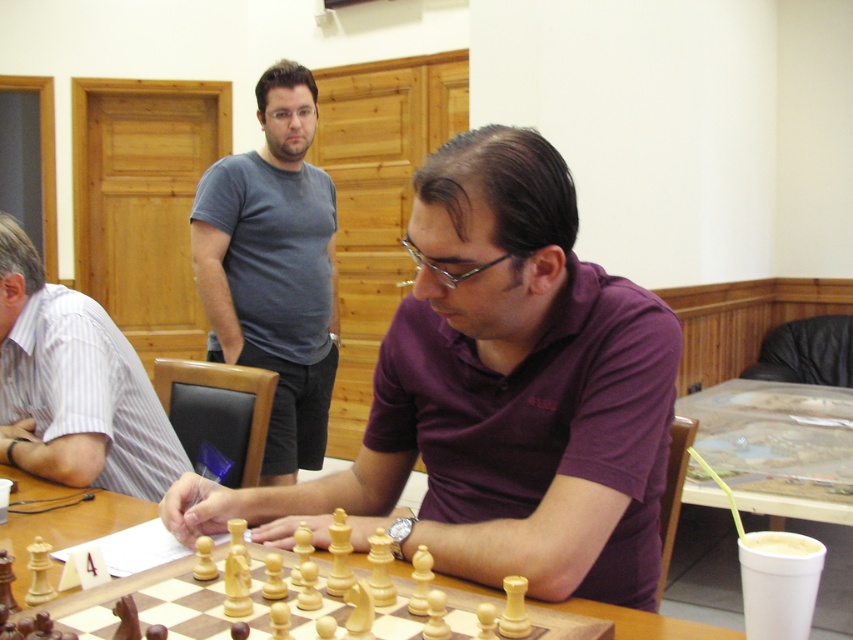
You are standing at the entrance of the community center and see the white striped shirt at left and the wooden chessboard at center. Which object is closer to you?

The white striped shirt at left is closer to you because the wooden chessboard at center is behind it.

You are a photographer positioned at the back of the room. You want to take a photo of both the purple cotton shirt at center and the white striped shirt at left without any obstruction. Which person should you move closer to the camera to ensure both are visible?

The purple cotton shirt at center is in front of the white striped shirt at left, so you should move the white striped shirt at left closer to the camera to avoid being blocked by the purple cotton shirt at center.